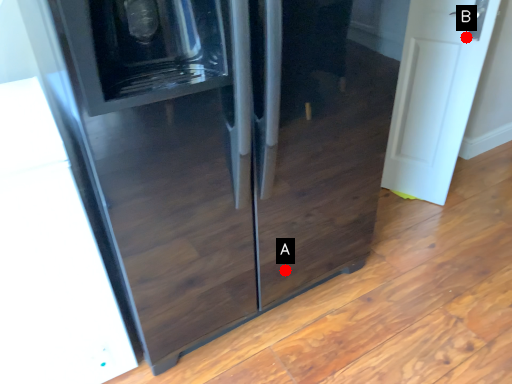
Question: Two points are circled on the image, labeled by A and B beside each circle. Among these points, which one is farthest from the camera?

Choices:
 (A) A is further
 (B) B is further

Answer: (B)